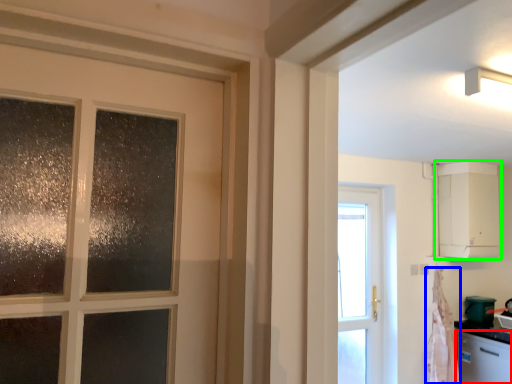
Question: Considering the real-world distances, which object is closest to dish washer (highlighted by a red box)? curtain (highlighted by a blue box) or cabinetry (highlighted by a green box).

Choices:
 (A) curtain
 (B) cabinetry

Answer: (A)